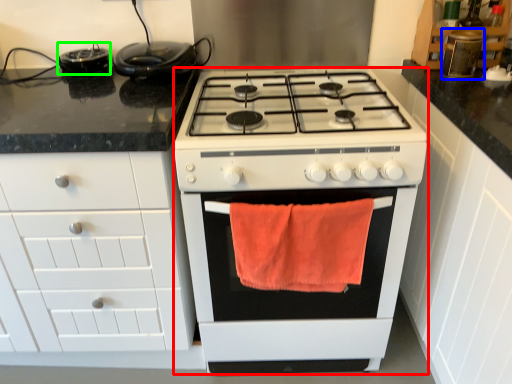
Question: Which object is positioned closest to appliance (highlighted by a red box)? Select from appliance (highlighted by a blue box) and appliance (highlighted by a green box).

Choices:
 (A) appliance
 (B) appliance

Answer: (A)